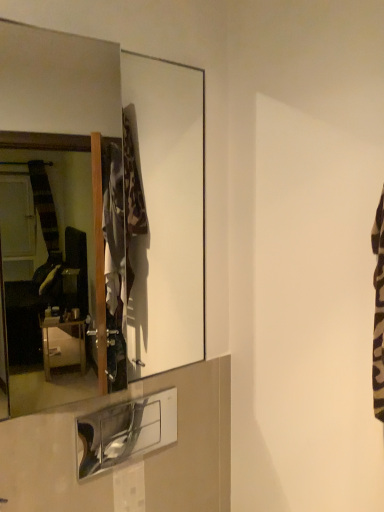
Question: From a real-world perspective, is matte glass mirror at upper left above or below metallic silver shelf at lower center?

Choices:
 (A) above
 (B) below

Answer: (A)

Question: Considering the positions of matte glass mirror at upper left and metallic silver shelf at lower center in the image, is matte glass mirror at upper left taller or shorter than metallic silver shelf at lower center?

Choices:
 (A) short
 (B) tall

Answer: (B)

Question: Looking at the image, does matte glass mirror at upper left seem bigger or smaller compared to metallic silver shelf at lower center?

Choices:
 (A) small
 (B) big

Answer: (B)

Question: From a real-world perspective, relative to matte glass mirror at upper left, is metallic silver shelf at lower center vertically above or below?

Choices:
 (A) above
 (B) below

Answer: (B)

Question: Is metallic silver shelf at lower center bigger or smaller than matte glass mirror at upper left?

Choices:
 (A) big
 (B) small

Answer: (B)

Question: Is metallic silver shelf at lower center in front of or behind matte glass mirror at upper left in the image?

Choices:
 (A) behind
 (B) front

Answer: (A)

Question: Would you say metallic silver shelf at lower center is to the left or to the right of matte glass mirror at upper left in the picture?

Choices:
 (A) left
 (B) right

Answer: (B)